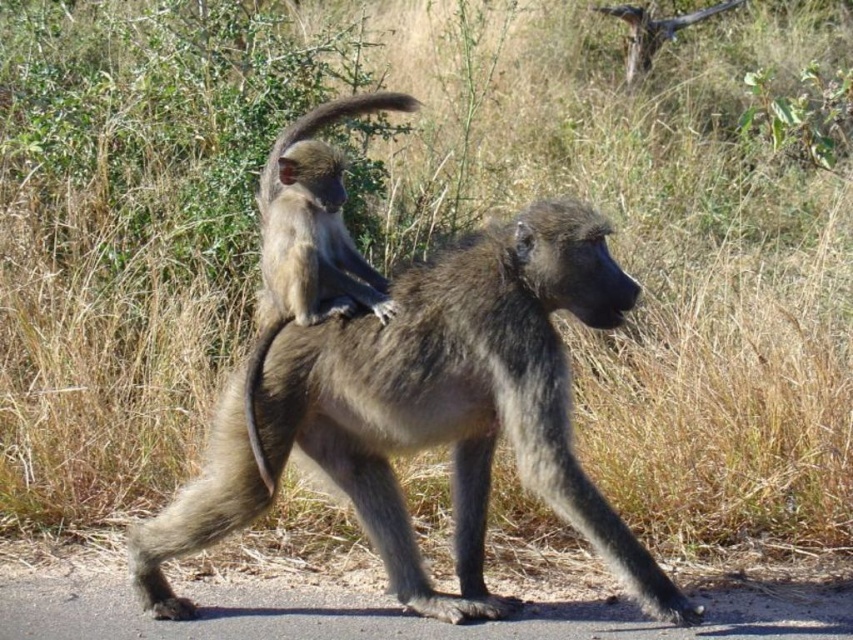
Question: Is gray furry monkey at center further to camera compared to gray furry monkey at upper center?

Choices:
 (A) no
 (B) yes

Answer: (A)

Question: Which point appears farthest from the camera in this image?

Choices:
 (A) (271, 333)
 (B) (183, 509)
 (C) (288, 236)

Answer: (B)

Question: Which point is farther to the camera?

Choices:
 (A) (370, 355)
 (B) (265, 236)
 (C) (267, 480)

Answer: (B)

Question: Is gray furry monkey at center closer to the viewer compared to fuzzy gray tail at center?

Choices:
 (A) yes
 (B) no

Answer: (A)

Question: Is gray furry monkey at center to the right of gray furry monkey at upper center from the viewer's perspective?

Choices:
 (A) yes
 (B) no

Answer: (A)

Question: Which object is the closest to the gray furry monkey at center?

Choices:
 (A) fuzzy gray tail at center
 (B) gray furry monkey at upper center

Answer: (B)